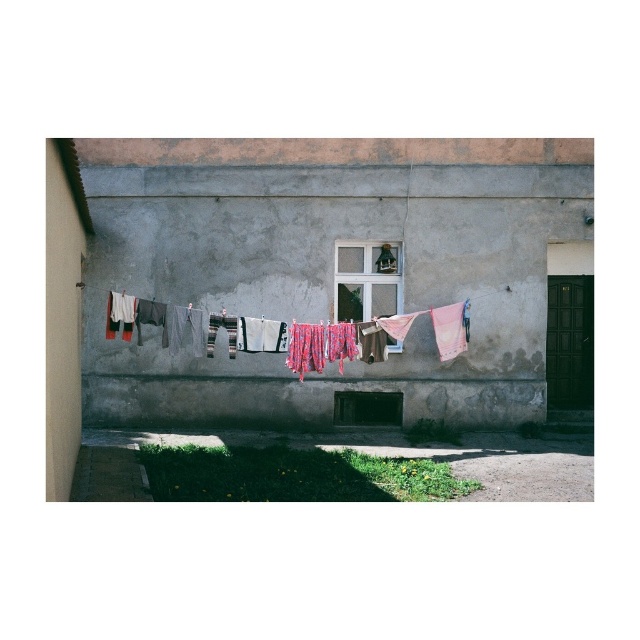
Question: Which point appears closest to the camera in this image?

Choices:
 (A) (355, 285)
 (B) (355, 353)

Answer: (B)

Question: Does multicolored fabric at center lie in front of clear glass window at center?

Choices:
 (A) no
 (B) yes

Answer: (B)

Question: Is multicolored fabric at center thinner than clear glass window at center?

Choices:
 (A) no
 (B) yes

Answer: (A)

Question: Can you confirm if multicolored fabric at center is positioned to the left of clear glass window at center?

Choices:
 (A) no
 (B) yes

Answer: (B)